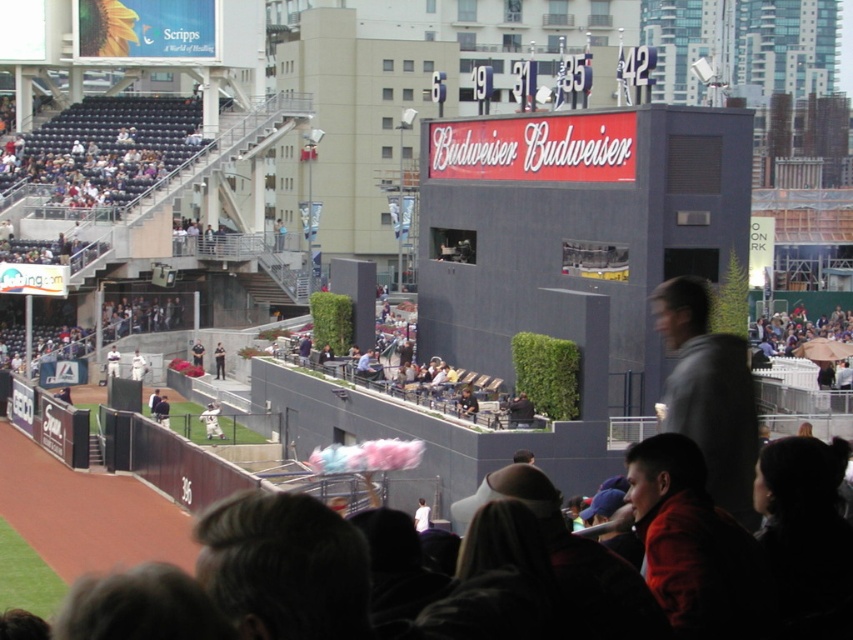
Looking at this image, is white baseball glove at center smaller than white baseball uniform at center?

Correct, white baseball glove at center occupies less space than white baseball uniform at center.

Is white baseball glove at center thinner than white baseball uniform at center?

Indeed, white baseball glove at center has a lesser width compared to white baseball uniform at center.

Who is more forward, [144,364] or [113,365]?

Point [113,365]

This screenshot has width=853, height=640. In order to click on white baseball glove at center in this screenshot , I will do `click(137, 365)`.

Who is lower down, white jersey at center or white cotton candy at center?

white jersey at center

Is white jersey at center bigger than white cotton candy at center?

Actually, white jersey at center might be smaller than white cotton candy at center.

The height and width of the screenshot is (640, 853). Describe the element at coordinates (212, 420) in the screenshot. I see `white jersey at center` at that location.

At what (x,y) coordinates should I click in order to perform the action: click on white jersey at center. Please return your answer as a coordinate pair (x, y). This screenshot has height=640, width=853. Looking at the image, I should click on (212, 420).

What do you see at coordinates (212, 420) in the screenshot? Image resolution: width=853 pixels, height=640 pixels. I see `white jersey at center` at bounding box center [212, 420].

Between white jersey at center and white baseball uniform at center, which one appears on the right side from the viewer's perspective?

white jersey at center

Is point (210, 410) in front of point (109, 371)?

Yes.

Where is `white jersey at center`? white jersey at center is located at coordinates (212, 420).